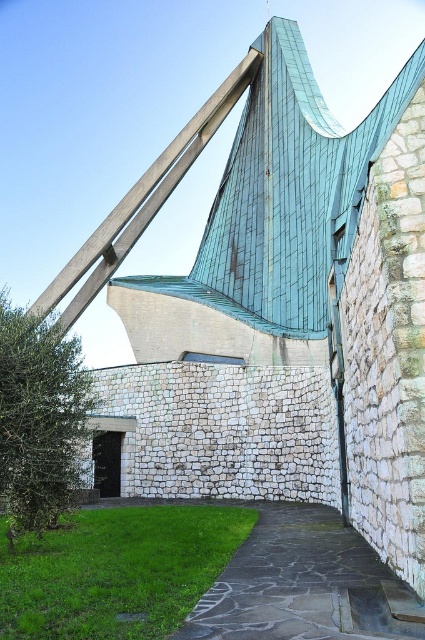
Is green grass at lower left to the right of green patina metal beam at upper center from the viewer's perspective?

Correct, you'll find green grass at lower left to the right of green patina metal beam at upper center.

Between point (87, 627) and point (90, 241), which one is positioned behind?

Point (90, 241)

The width and height of the screenshot is (425, 640). What do you see at coordinates (116, 570) in the screenshot?
I see `green grass at lower left` at bounding box center [116, 570].

This screenshot has height=640, width=425. I want to click on green grass at lower left, so click(x=116, y=570).

Does green grass at lower left lie behind paved stone path at lower center?

Yes.

Locate an element on the screen. The image size is (425, 640). green grass at lower left is located at coordinates (116, 570).

Based on the photo, does paved stone path at lower center appear over green patina metal beam at upper center?

No.

Locate an element on the screen. The image size is (425, 640). paved stone path at lower center is located at coordinates (291, 580).

Is point (340, 534) more distant than point (147, 204)?

No, (340, 534) is closer to viewer.

Find the location of `paved stone path at lower center`. paved stone path at lower center is located at coordinates (291, 580).